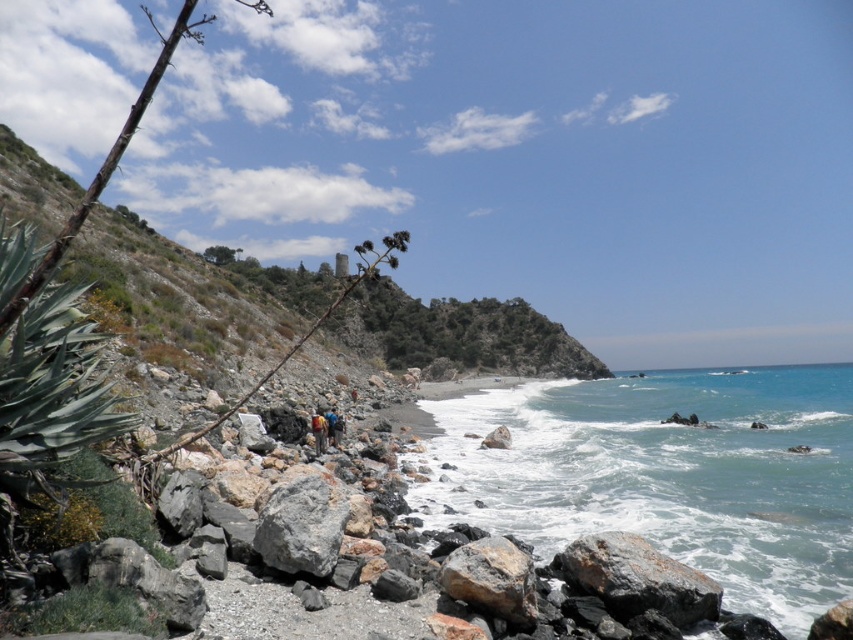
You are a hiker standing on the rocky shoreline and want to reach the gray rough rock at center. Which direction should you move relative to the gray rough rock at lower center?

You should move upward from the gray rough rock at lower center to reach the gray rough rock at center since the gray rough rock at lower center is positioned under the gray rough rock at center.

In the scene shown: You are standing at the shoreline looking towards the rocky beach. There are two points marked on the image. The first point is at coordinate [583,570] and the second point is at coordinate [257,548]. Which point is closer to you?

Point [257,548] is closer to you because it is less further to the camera than point [583,570].

In the scene shown: You are standing at the center of the beach and see the gray rough rock at center and the blue fabric backpack at center. If you want to pick up the backpack first, which object should you move towards first?

The gray rough rock at center is 27.11 meters from blue fabric backpack at center. Since you want to pick up the backpack first, you should move towards the blue fabric backpack at center first.